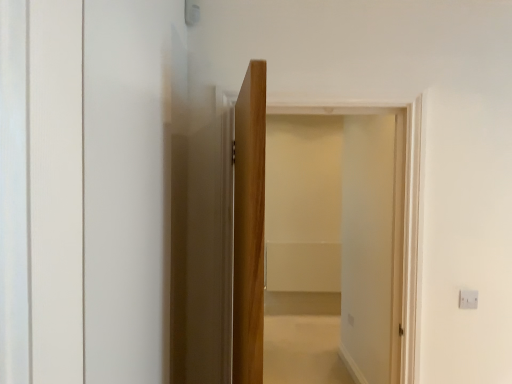
Question: From a real-world perspective, is light brown wood door at center positioned above or below clear glass screen door at center?

Choices:
 (A) above
 (B) below

Answer: (A)

Question: Considering the positions of light brown wood door at center and clear glass screen door at center in the image, is light brown wood door at center wider or thinner than clear glass screen door at center?

Choices:
 (A) thin
 (B) wide

Answer: (A)

Question: Considering the positions of light brown wood door at center and clear glass screen door at center in the image, is light brown wood door at center bigger or smaller than clear glass screen door at center?

Choices:
 (A) big
 (B) small

Answer: (B)

Question: Considering the positions of point (308, 158) and point (231, 251), is point (308, 158) closer or farther from the camera than point (231, 251)?

Choices:
 (A) closer
 (B) farther

Answer: (B)

Question: Is clear glass screen door at center in front of or behind light brown wood door at center in the image?

Choices:
 (A) behind
 (B) front

Answer: (A)

Question: In terms of width, does clear glass screen door at center look wider or thinner when compared to light brown wood door at center?

Choices:
 (A) thin
 (B) wide

Answer: (B)

Question: Looking at the image, does clear glass screen door at center seem bigger or smaller compared to light brown wood door at center?

Choices:
 (A) small
 (B) big

Answer: (B)